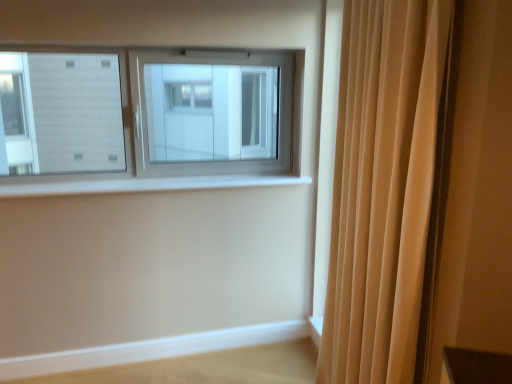
Question: Does beige fabric curtain at right turn towards light wood ledge at lower right?

Choices:
 (A) no
 (B) yes

Answer: (A)

Question: Can you confirm if beige fabric curtain at right is taller than light wood ledge at lower right?

Choices:
 (A) no
 (B) yes

Answer: (B)

Question: Is beige fabric curtain at right far from light wood ledge at lower right?

Choices:
 (A) no
 (B) yes

Answer: (B)

Question: From the image's perspective, is beige fabric curtain at right located above light wood ledge at lower right?

Choices:
 (A) no
 (B) yes

Answer: (B)

Question: Is beige fabric curtain at right at the left side of light wood ledge at lower right?

Choices:
 (A) no
 (B) yes

Answer: (A)

Question: Is beige fabric curtain at right outside of light wood ledge at lower right?

Choices:
 (A) no
 (B) yes

Answer: (B)

Question: Is white smooth window sill at center next to beige fabric curtain at right and touching it?

Choices:
 (A) no
 (B) yes

Answer: (A)

Question: Could you tell me if white smooth window sill at center is turned towards beige fabric curtain at right?

Choices:
 (A) no
 (B) yes

Answer: (B)

Question: From the image's perspective, is white smooth window sill at center on beige fabric curtain at right?

Choices:
 (A) no
 (B) yes

Answer: (B)

Question: From a real-world perspective, does white smooth window sill at center stand above beige fabric curtain at right?

Choices:
 (A) yes
 (B) no

Answer: (B)

Question: From the image's perspective, is white smooth window sill at center below beige fabric curtain at right?

Choices:
 (A) no
 (B) yes

Answer: (A)

Question: Is white smooth window sill at center closer to the viewer compared to beige fabric curtain at right?

Choices:
 (A) yes
 (B) no

Answer: (B)

Question: Can you confirm if beige fabric curtain at right is taller than white smooth window sill at center?

Choices:
 (A) no
 (B) yes

Answer: (B)